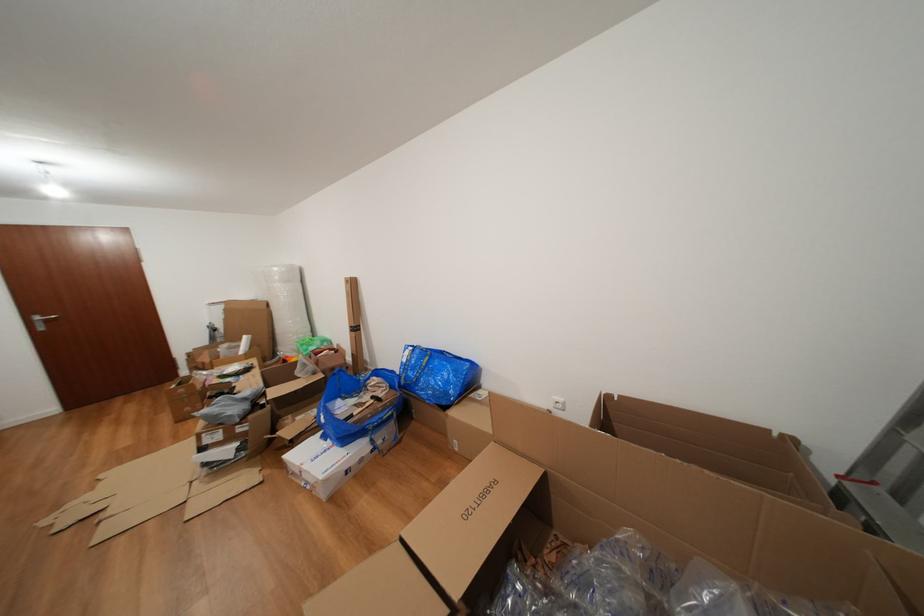
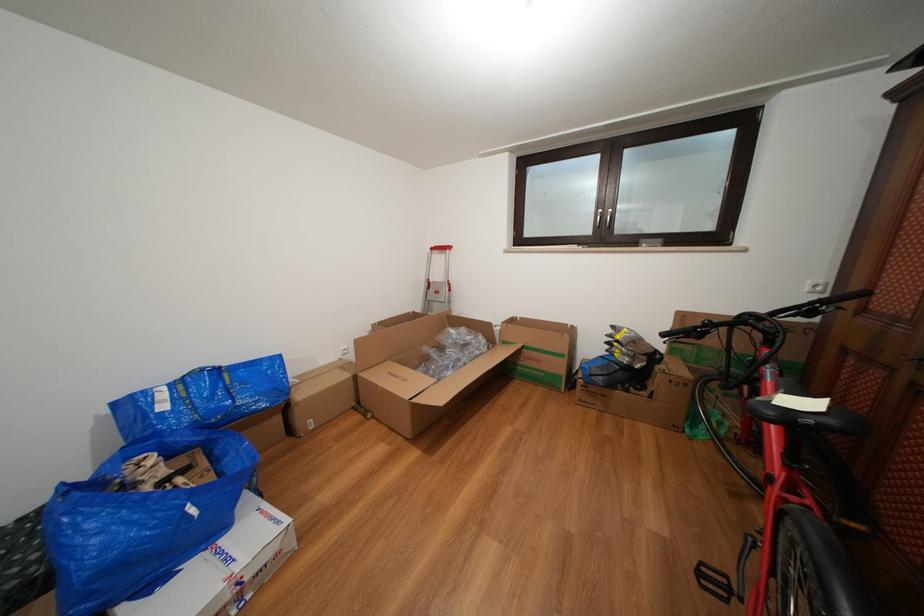
In the second image, find the point that corresponds to [331,422] in the first image.

(201, 516)